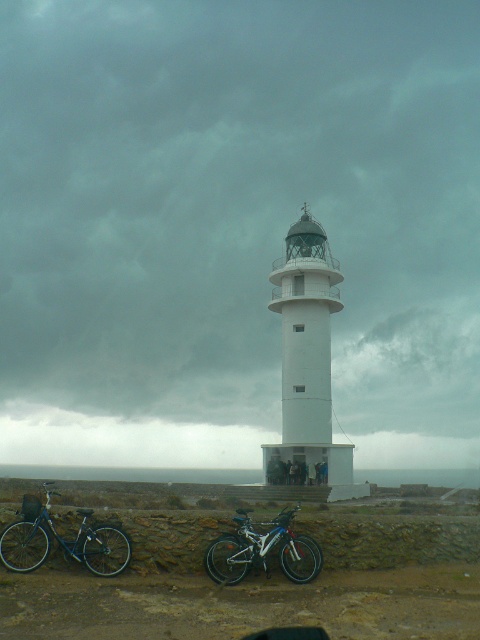
You are a visitor at the lighthouse and want to take a photo of the white matte lighthouse at center and the silver metallic bicycle at lower center. If you stand at the base of the lighthouse, which object should you look towards to include both in your photo?

To include both the white matte lighthouse at center and the silver metallic bicycle at lower center in your photo, you should look towards the right side since the white matte lighthouse at center is positioned on the left side of the silver metallic bicycle at lower center.

You are standing at the lighthouse and looking towards the bicycles parked against the stone wall. There are two points marked on the ground where the bicycles are placed. The first point is at coordinates point (x=412, y=243) and the second is at point (x=279, y=554). From your vantage point at the lighthouse, which point is closer to you?

Point (x=279, y=554) is closer to you because the description states that point (x=412, y=243) is behind point (x=279, y=554), meaning the latter is nearer to your position at the lighthouse.